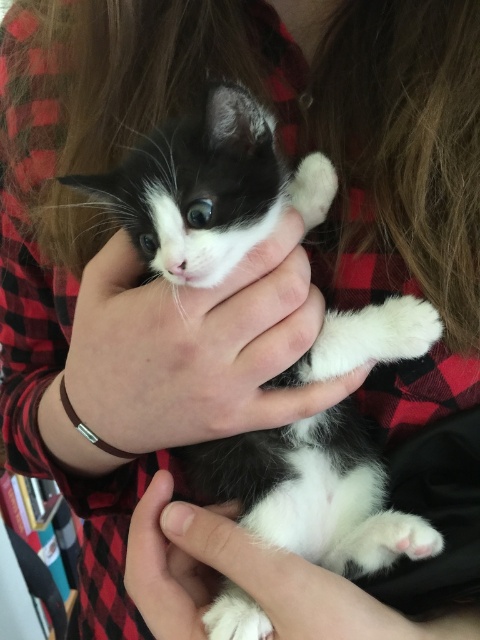
You are a veterinarian examining a kitten. You notice the soft fur kitten at center and the white fur at center. Which one is positioned higher in the image?

The soft fur kitten at center is located above the white fur at center, so the soft fur kitten at center is positioned higher in the image.

You are a veterinarian examining a small kitten. You notice the soft fur kitten at center and the white fur at center. How far apart are these two areas of fur on the kitten?

The soft fur kitten at center is 5.09 inches from the white fur at center.

You are a veterinarian examining the image of a kitten. You notice the soft fur kitten at center and the white fur at center. Which one is bigger?

The soft fur kitten at center is larger in size compared to the white fur at center.